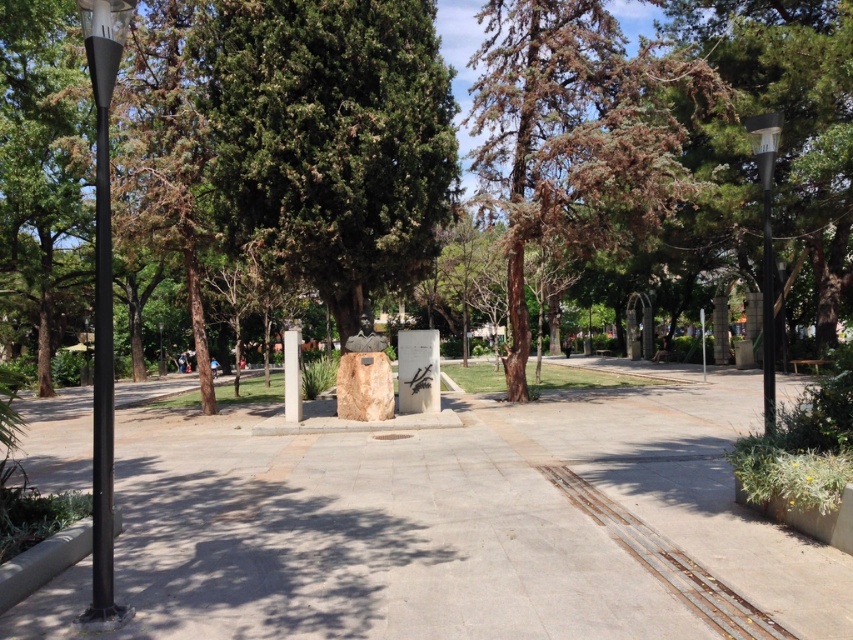
Question: Which of these objects is positioned farthest from the rusty metal train track at lower right?

Choices:
 (A) black matte lamp post at left
 (B) brown textured tree at center
 (C) green textured tree at center

Answer: (B)

Question: Where is gray concrete pavement at center located in relation to rusty metal train track at lower right in the image?

Choices:
 (A) right
 (B) left

Answer: (B)

Question: Is rusty metal train track at lower right to the left of metallic gray pole at right from the viewer's perspective?

Choices:
 (A) yes
 (B) no

Answer: (A)

Question: Estimate the real-world distances between objects in this image. Which object is closer to the metallic gray pole at right?

Choices:
 (A) brown textured tree at center
 (B) black matte lamp post at left
 (C) rusty metal train track at lower right

Answer: (C)

Question: Does rusty metal train track at lower right appear on the right side of metallic gray pole at right?

Choices:
 (A) no
 (B) yes

Answer: (A)

Question: Which object is closer to the camera taking this photo?

Choices:
 (A) brown textured tree at center
 (B) gray concrete pavement at center
 (C) black matte lamp post at left
 (D) green textured tree at center

Answer: (B)